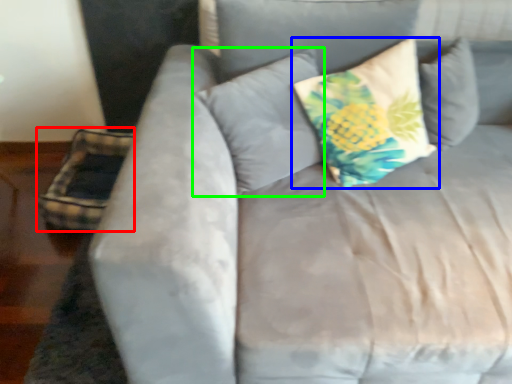
Question: Considering the real-world distances, which object is farthest from pillow (highlighted by a red box)? pillow (highlighted by a blue box) or pillow (highlighted by a green box)?

Choices:
 (A) pillow
 (B) pillow

Answer: (A)